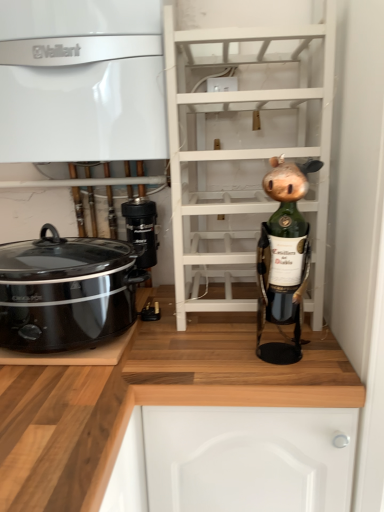
Question: Is white glossy vaillant boiler at upper left, the second cabinetry ordered from the bottom, in front of wooden at lower right, which is counted as the 1th cabinetry, starting from the bottom?

Choices:
 (A) yes
 (B) no

Answer: (B)

Question: Is white glossy vaillant boiler at upper left, the second cabinetry ordered from the bottom, thinner than wooden at lower right, which is counted as the 1th cabinetry, starting from the bottom?

Choices:
 (A) no
 (B) yes

Answer: (B)

Question: Can you confirm if white glossy vaillant boiler at upper left, the second cabinetry ordered from the bottom, is smaller than wooden at lower right, which is the second cabinetry in top-to-bottom order?

Choices:
 (A) yes
 (B) no

Answer: (A)

Question: Is white glossy vaillant boiler at upper left, the second cabinetry ordered from the bottom, facing away from wooden at lower right, which is counted as the 1th cabinetry, starting from the bottom?

Choices:
 (A) yes
 (B) no

Answer: (B)

Question: Is white glossy vaillant boiler at upper left, placed as the first cabinetry when sorted from top to bottom, to the left of wooden at lower right, which is the second cabinetry in top-to-bottom order, from the viewer's perspective?

Choices:
 (A) yes
 (B) no

Answer: (A)

Question: Is white glossy vaillant boiler at upper left, placed as the first cabinetry when sorted from top to bottom, completely or partially outside of wooden at lower right, which is the second cabinetry in top-to-bottom order?

Choices:
 (A) yes
 (B) no

Answer: (A)

Question: Can you confirm if white glossy vaillant boiler at upper left, placed as the first cabinetry when sorted from top to bottom, is bigger than white wooden shelf at center?

Choices:
 (A) no
 (B) yes

Answer: (A)

Question: Considering the relative sizes of white glossy vaillant boiler at upper left, the second cabinetry ordered from the bottom, and white wooden shelf at center in the image provided, is white glossy vaillant boiler at upper left, the second cabinetry ordered from the bottom, shorter than white wooden shelf at center?

Choices:
 (A) no
 (B) yes

Answer: (B)

Question: Considering the relative sizes of white glossy vaillant boiler at upper left, the second cabinetry ordered from the bottom, and white wooden shelf at center in the image provided, is white glossy vaillant boiler at upper left, the second cabinetry ordered from the bottom, taller than white wooden shelf at center?

Choices:
 (A) no
 (B) yes

Answer: (A)

Question: Does white glossy vaillant boiler at upper left, the second cabinetry ordered from the bottom, have a greater width compared to white wooden shelf at center?

Choices:
 (A) yes
 (B) no

Answer: (B)

Question: Is white glossy vaillant boiler at upper left, the second cabinetry ordered from the bottom, with white wooden shelf at center?

Choices:
 (A) no
 (B) yes

Answer: (A)

Question: From a real-world perspective, does white glossy vaillant boiler at upper left, placed as the first cabinetry when sorted from top to bottom, stand above white wooden shelf at center?

Choices:
 (A) no
 (B) yes

Answer: (B)

Question: Is wooden at lower right, which is counted as the 1th cabinetry, starting from the bottom, facing towards white glossy vaillant boiler at upper left, placed as the first cabinetry when sorted from top to bottom?

Choices:
 (A) yes
 (B) no

Answer: (B)